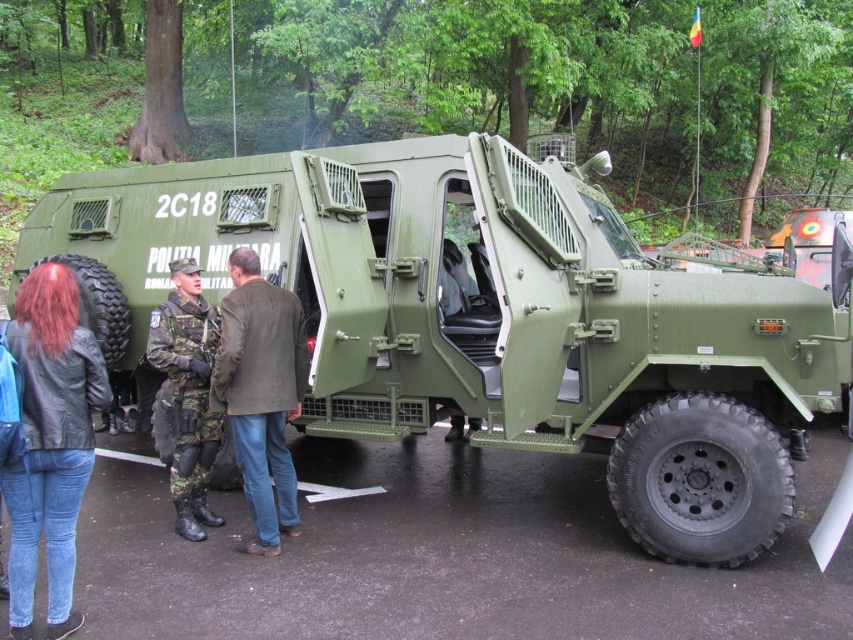
Between brown leather jacket at center and camouflage fabric uniform at center, which one appears on the right side from the viewer's perspective?

brown leather jacket at center is more to the right.

From the picture: Is brown leather jacket at center to the right of camouflage fabric uniform at center from the viewer's perspective?

Correct, you'll find brown leather jacket at center to the right of camouflage fabric uniform at center.

You are a GUI agent. You are given a task and a screenshot of the screen. Output one action in this format:
    pyautogui.click(x=<x>, y=<y>)
    Task: Click on the brown leather jacket at center
    Image resolution: width=853 pixels, height=640 pixels.
    Given the screenshot: What is the action you would take?
    pyautogui.click(x=260, y=394)

Looking at this image, who is more forward, (x=791, y=480) or (x=33, y=422)?

Point (x=33, y=422) is in front.

Between matte green armored vehicle at center and black leather jacket at lower left, which one is positioned lower?

Positioned lower is black leather jacket at lower left.

Does point (213, 216) come behind point (59, 502)?

Yes, point (213, 216) is behind point (59, 502).

Locate an element on the screen. The width and height of the screenshot is (853, 640). matte green armored vehicle at center is located at coordinates (491, 316).

From the picture: Which of these two, black leather jacket at lower left or brown leather jacket at center, stands shorter?

Standing shorter between the two is black leather jacket at lower left.

Is black leather jacket at lower left positioned at the back of brown leather jacket at center?

No, it is not.

Identify the location of black leather jacket at lower left. This screenshot has width=853, height=640. (50, 442).

The width and height of the screenshot is (853, 640). What are the coordinates of `black leather jacket at lower left` in the screenshot? It's located at (50, 442).